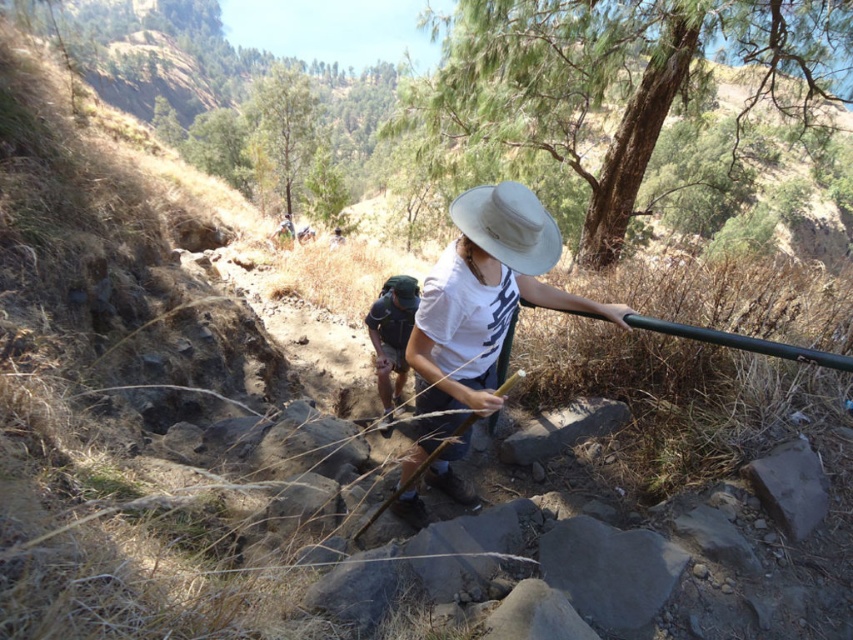
You are a hiker trying to locate your beige fabric hat at center and camouflage backpack at center. According to the scene, which item is positioned to the right of the other?

The beige fabric hat at center is to the right of the camouflage backpack at center.

You are a hiker trying to navigate the rocky path in the mountain trail. You see two points marked on the path. Which point is closer to you, point (438, 483) or point (376, 353)?

Point (438, 483) is closer to you than point (376, 353).

You are a hiker trying to locate your backpack which is placed near your hat. Given that the beige fabric hat at center is 8.99 feet away from the camouflage backpack at center, can you safely reach the backpack without moving more than 10 feet from your current position?

The distance between the beige fabric hat at center and the camouflage backpack at center is 8.99 feet, which is less than 10 feet. Therefore, you can safely reach the backpack without moving more than 10 feet from your current position.